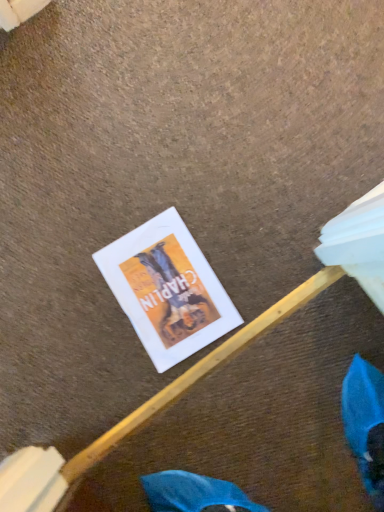
You are a GUI agent. You are given a task and a screenshot of the screen. Output one action in this format:
    pyautogui.click(x=<x>, y=<y>)
    Task: Click on the empty space that is to the right of white paper book at center
    This screenshot has height=512, width=384.
    Given the screenshot: What is the action you would take?
    pyautogui.click(x=242, y=223)